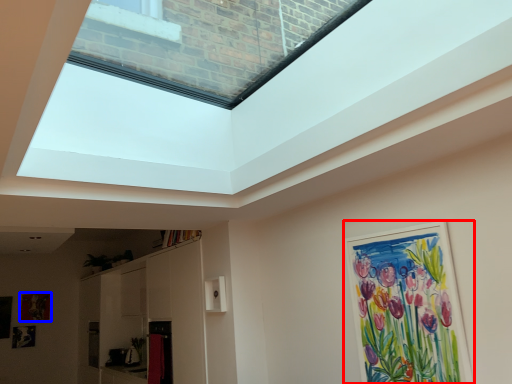
Question: Which object appears closest to the camera in this image, picture frame (highlighted by a red box) or picture frame (highlighted by a blue box)?

Choices:
 (A) picture frame
 (B) picture frame

Answer: (A)